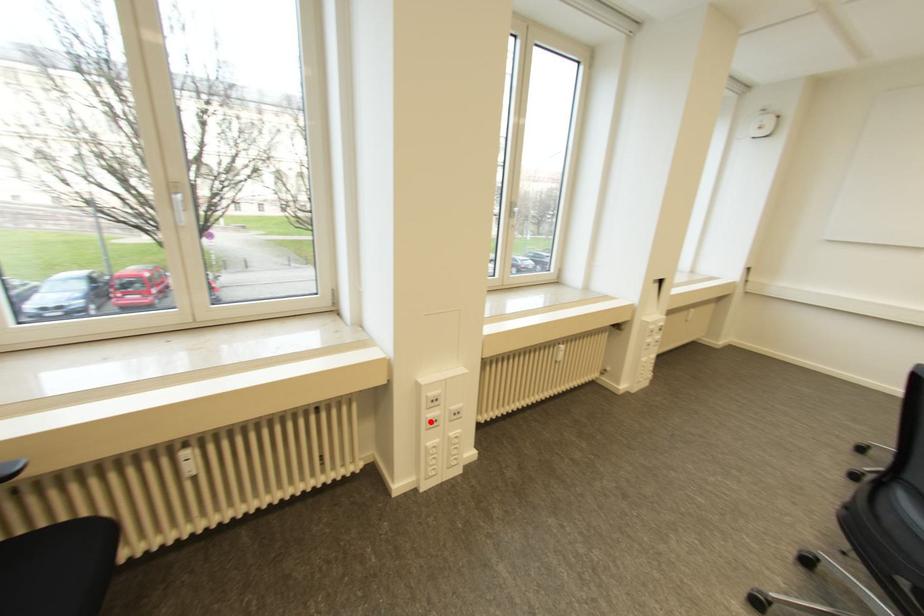
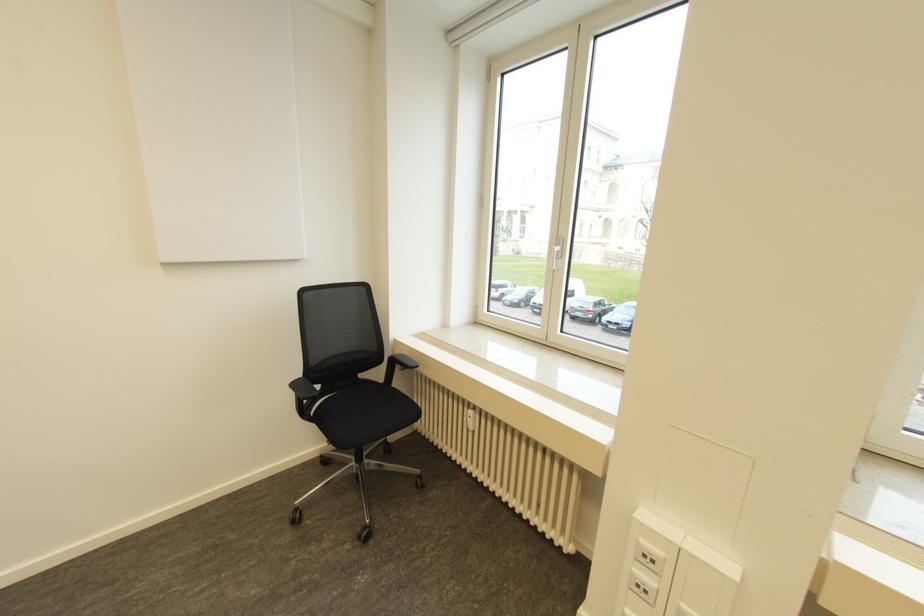
Question: I am providing you with two images of the same scene from different viewpoints. Given a red point in image1, look at the same physical point in image2. Is it:

Choices:
 (A) Closer to the viewpoint
 (B) Farther from the viewpoint

Answer: (A)